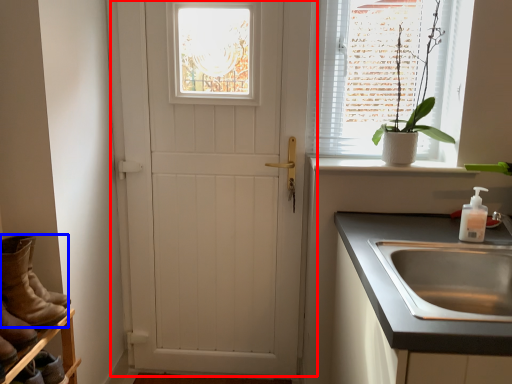
Question: Which point is further to the camera, door (highlighted by a red box) or footwear (highlighted by a blue box)?

Choices:
 (A) door
 (B) footwear

Answer: (A)